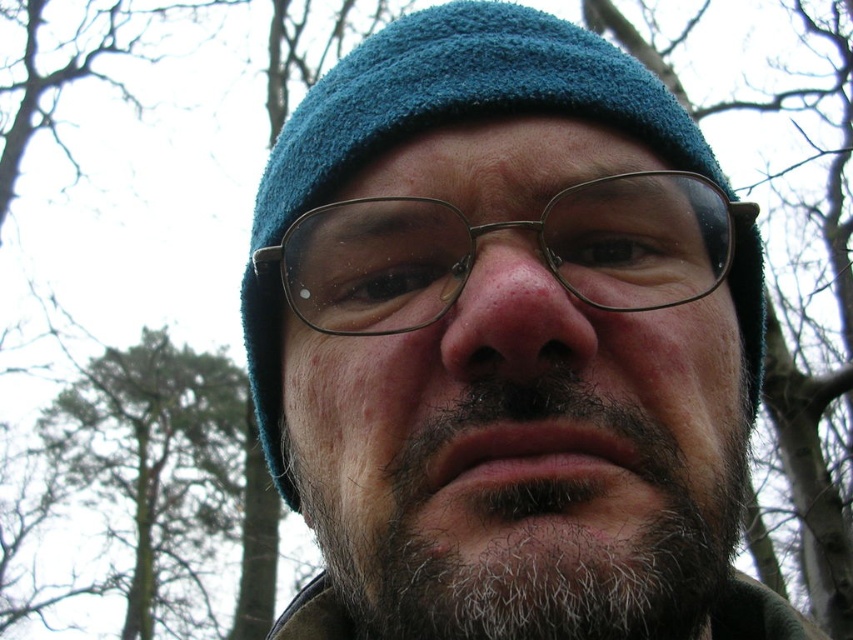
Based on the scene description, which object is positioned higher on the person depicted in the image, the dry matte nose at center or the dry skin at center?

The dry matte nose at center is positioned higher than the dry skin at center.

The image shows a person in a forested area. The person has a teal knit cap and glasses. There is a point at coordinate (535, 525). What is located at that point?

The point at coordinate (535, 525) corresponds to the gray woolly beard at center.